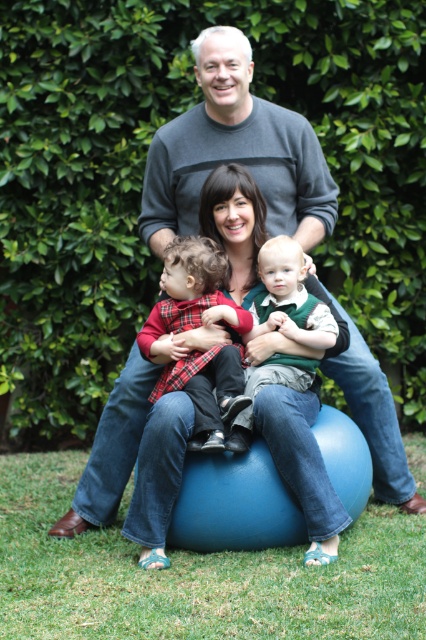
You are a photographer trying to capture a family photo. You need to ensure that the gray sweater at upper center and the plaid fabric shirt at center are in focus simultaneously. Given that your camera has a depth of field that can cover 60 centimeters, will both items be in focus?

The distance between the gray sweater at upper center and the plaid fabric shirt at center is 64.26 centimeters, which exceeds the camera depth of field of 60 centimeters. Therefore, both items cannot be in focus simultaneously.